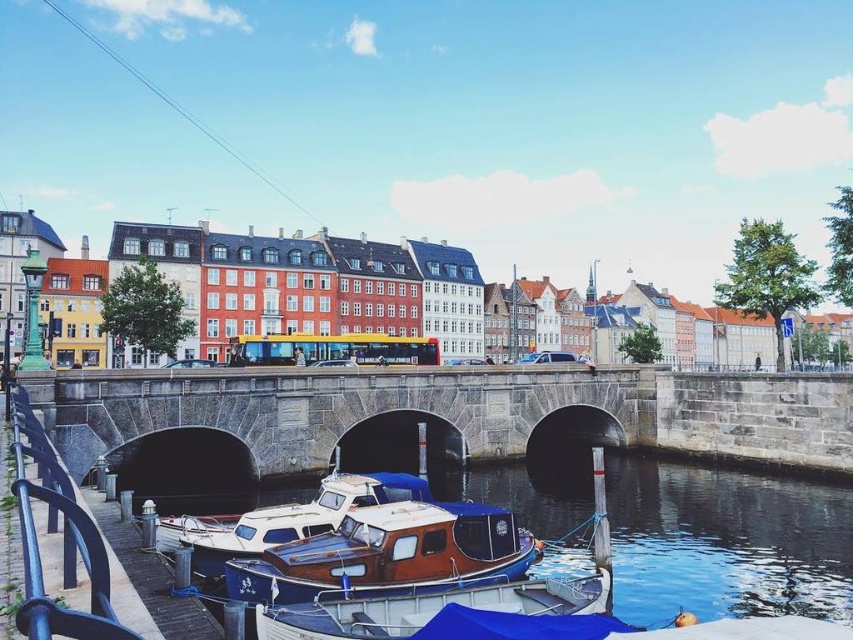
Question: Estimate the real-world distances between objects in this image. Which object is farther from the gray stone bridge at center?

Choices:
 (A) white glossy boat at center
 (B) wooden boat at center

Answer: (B)

Question: Which point appears farthest from the camera in this image?

Choices:
 (A) (556, 381)
 (B) (259, 560)
 (C) (403, 486)

Answer: (A)

Question: Is gray stone bridge at center below wooden polished boat at lower center?

Choices:
 (A) no
 (B) yes

Answer: (A)

Question: Which of the following is the closest to the observer?

Choices:
 (A) (201, 554)
 (B) (534, 417)

Answer: (A)

Question: Can you confirm if wooden polished boat at lower center is smaller than white glossy boat at center?

Choices:
 (A) no
 (B) yes

Answer: (B)

Question: Does wooden boat at center have a greater width compared to white glossy boat at center?

Choices:
 (A) yes
 (B) no

Answer: (A)